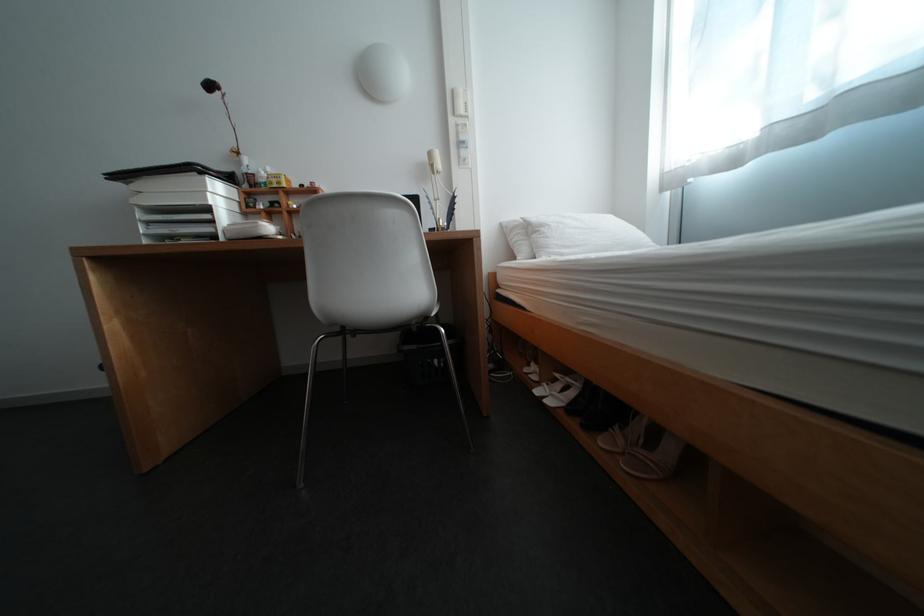
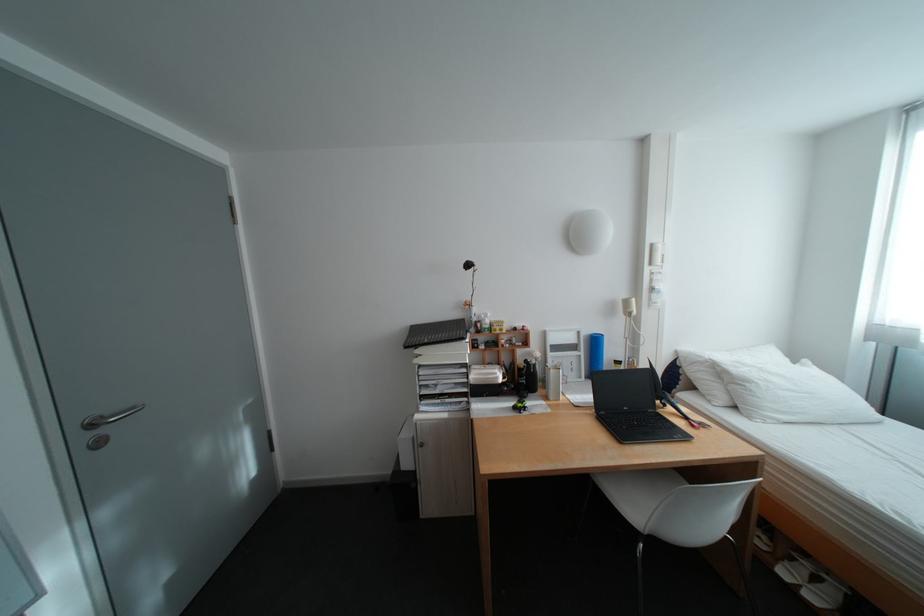
Locate, in the second image, the point that corresponds to (x=466, y=92) in the first image.

(664, 246)